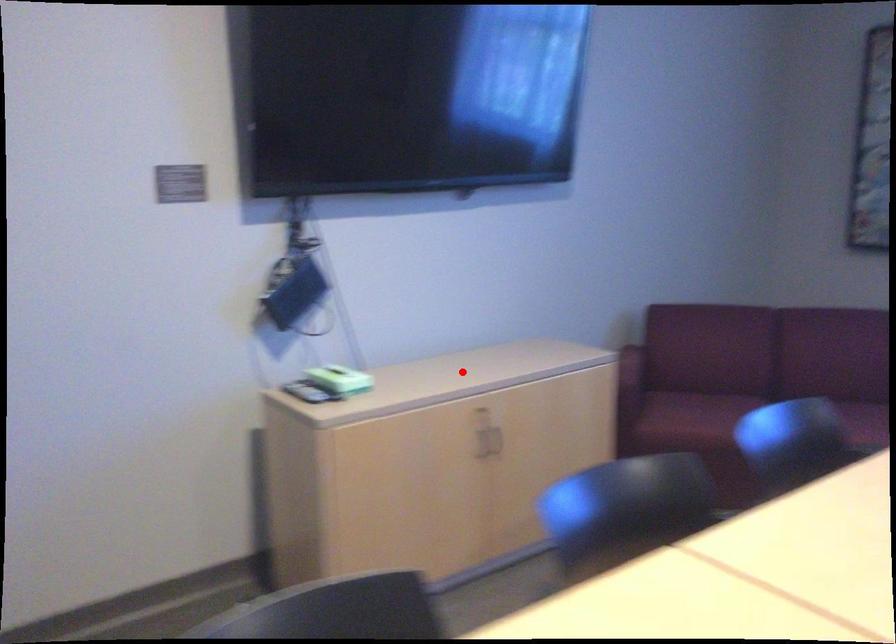
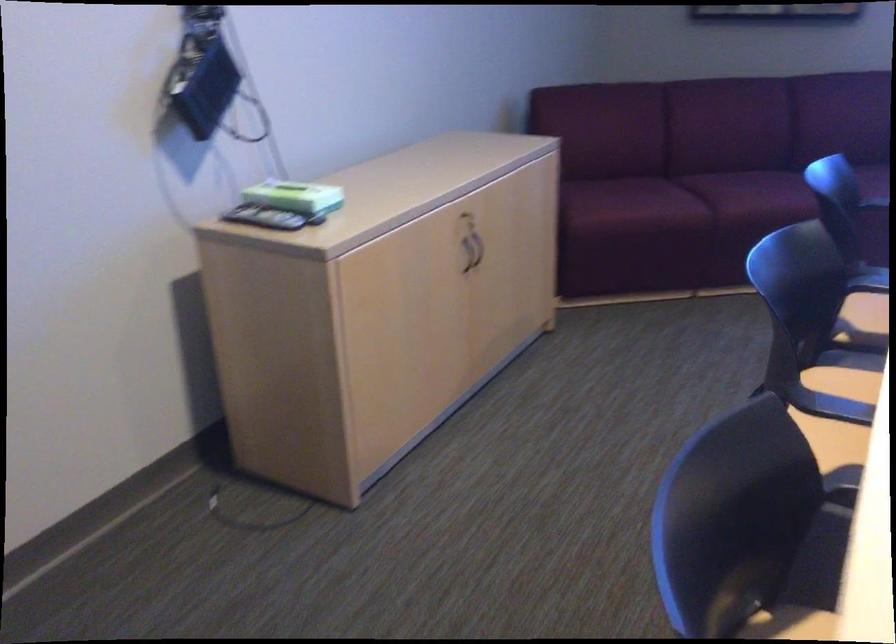
The point at the highlighted location is marked in the first image. Where is the corresponding point in the second image?

(428, 175)